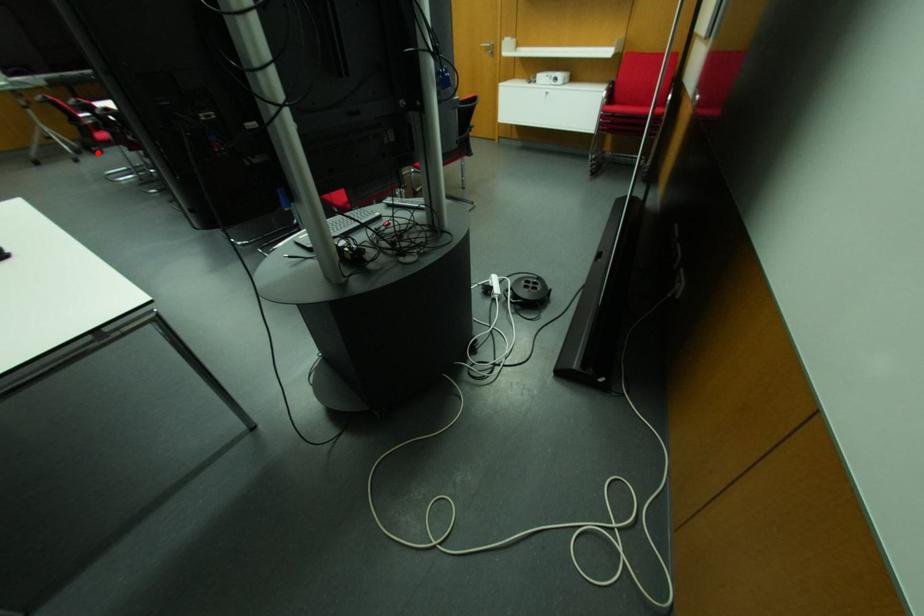
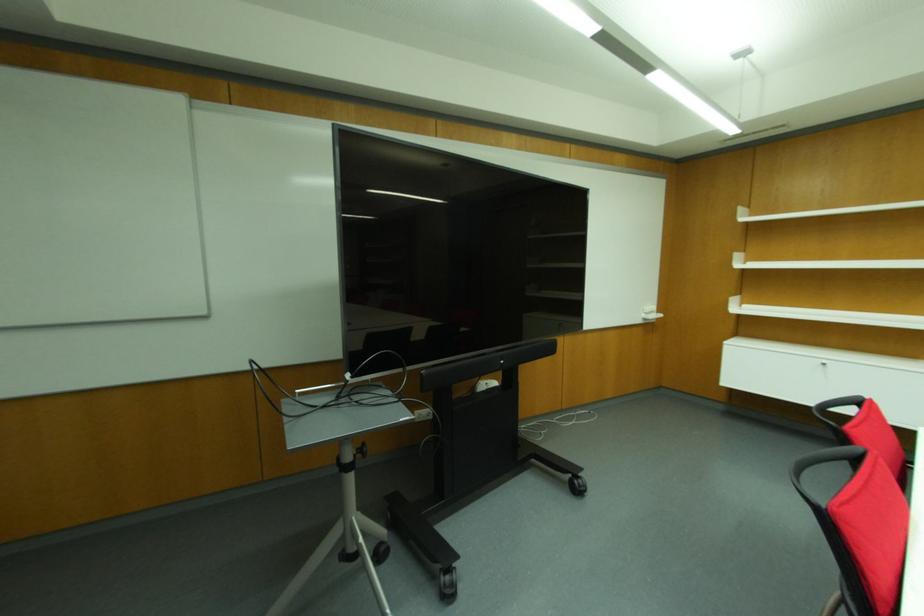
Find the pixel in the second image that matches the highlighted location in the first image.

(448, 594)